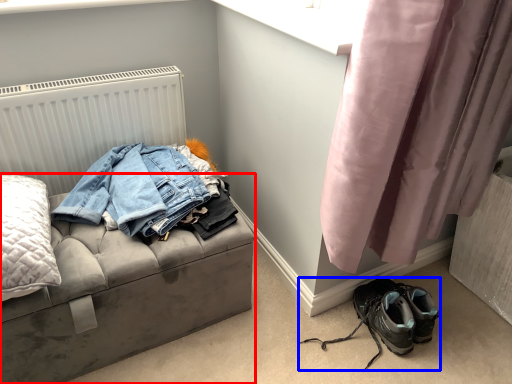
Question: Which object is closer to the camera taking this photo, furniture (highlighted by a red box) or footwear (highlighted by a blue box)?

Choices:
 (A) furniture
 (B) footwear

Answer: (A)